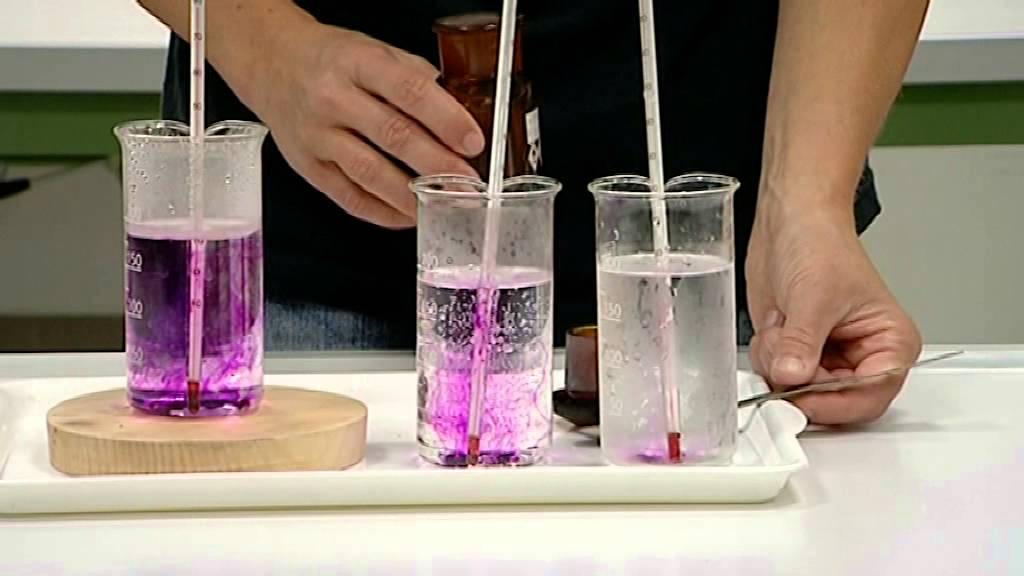
You are a GUI agent. You are given a task and a screenshot of the screen. Output one action in this format:
    pyautogui.click(x=<x>, y=<y>)
    Task: Click on the green stripe on wall
    The width and height of the screenshot is (1024, 576).
    Given the screenshot: What is the action you would take?
    pyautogui.click(x=989, y=126)